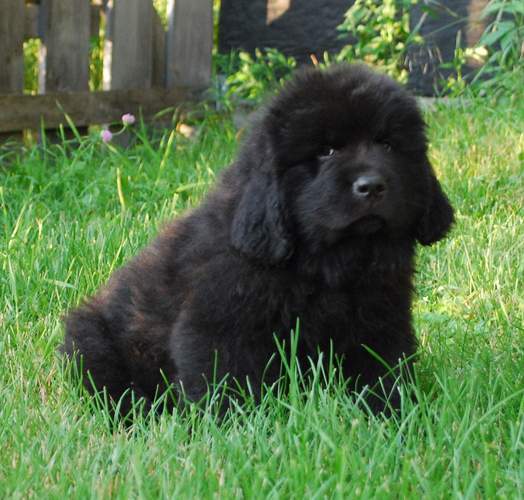
This screenshot has height=500, width=524. Find the location of `green plants`. green plants is located at coordinates (512, 3), (496, 29), (507, 40).